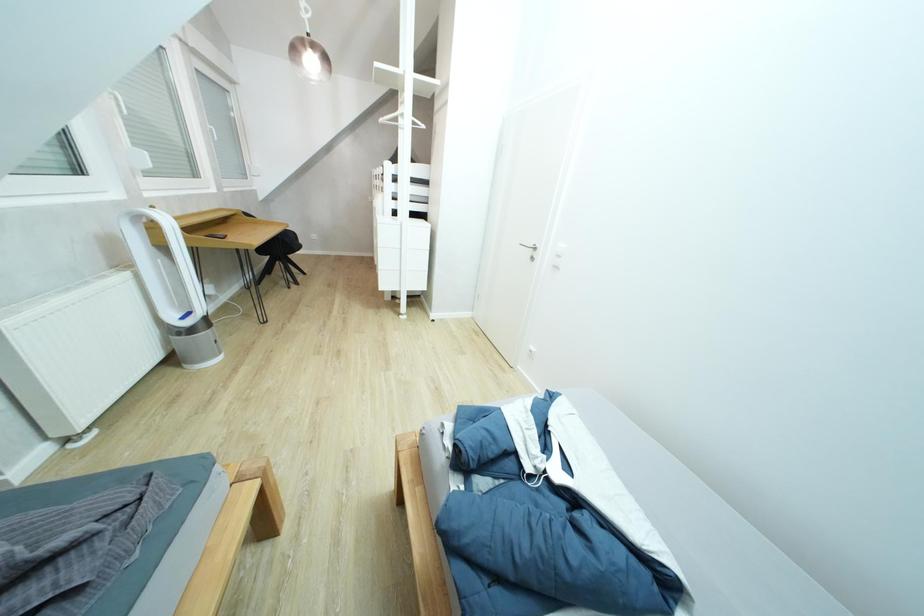
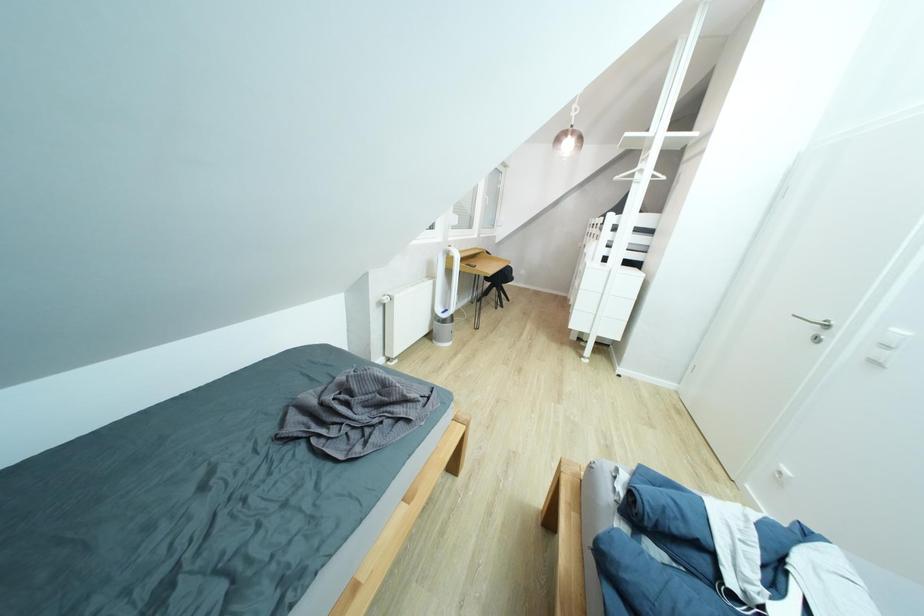
Question: The camera is either moving clockwise (left) or counter-clockwise (right) around the object. The first image is from the beginning of the video and the second image is from the end. Is the camera moving left or right when shooting the video?

Choices:
 (A) Left
 (B) Right

Answer: (B)